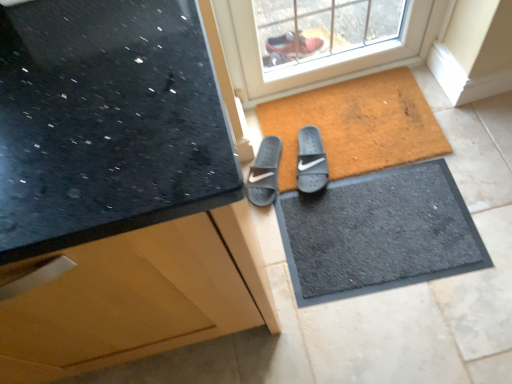
You are a GUI agent. You are given a task and a screenshot of the screen. Output one action in this format:
    pyautogui.click(x=<x>, y=<y>)
    Task: Click on the free space that is in between brown textured mat at center and black rubber doormat at center
    Image resolution: width=512 pixels, height=384 pixels.
    Given the screenshot: What is the action you would take?
    pyautogui.click(x=458, y=185)